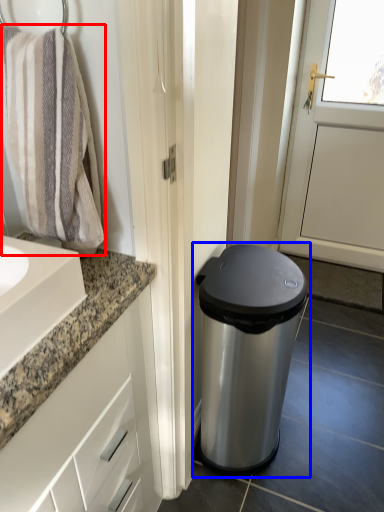
Question: Which object is closer to the camera taking this photo, bath towel (highlighted by a red box) or waste container (highlighted by a blue box)?

Choices:
 (A) bath towel
 (B) waste container

Answer: (A)